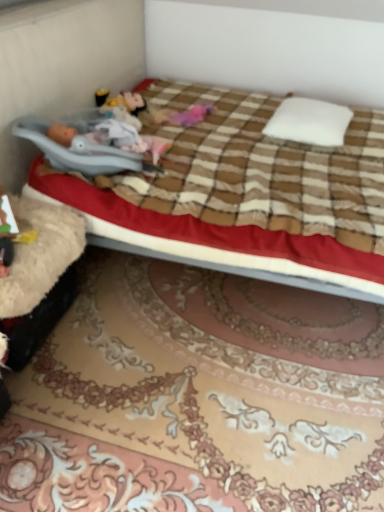
Question: From a real-world perspective, is pink fabric doll at center below white soft pillow at center?

Choices:
 (A) yes
 (B) no

Answer: (A)

Question: Is pink fabric doll at center placed right next to white soft pillow at center?

Choices:
 (A) no
 (B) yes

Answer: (A)

Question: Is white soft pillow at center inside pink fabric doll at center?

Choices:
 (A) yes
 (B) no

Answer: (B)

Question: Is pink fabric doll at center facing towards white soft pillow at center?

Choices:
 (A) no
 (B) yes

Answer: (A)

Question: Is pink fabric doll at center outside white soft pillow at center?

Choices:
 (A) no
 (B) yes

Answer: (B)

Question: From the image's perspective, is pink fabric doll at center on top of white soft pillow at center?

Choices:
 (A) yes
 (B) no

Answer: (A)

Question: From the image's perspective, would you say brown plaid blanket at center is shown under pink fabric doll at center?

Choices:
 (A) yes
 (B) no

Answer: (A)

Question: Is brown plaid blanket at center positioned before pink fabric doll at center?

Choices:
 (A) no
 (B) yes

Answer: (B)

Question: Is brown plaid blanket at center wider than pink fabric doll at center?

Choices:
 (A) yes
 (B) no

Answer: (A)

Question: Is brown plaid blanket at center further to the viewer compared to pink fabric doll at center?

Choices:
 (A) no
 (B) yes

Answer: (A)

Question: From the image's perspective, is brown plaid blanket at center above pink fabric doll at center?

Choices:
 (A) yes
 (B) no

Answer: (B)

Question: Considering the relative sizes of brown plaid blanket at center and pink fabric doll at center in the image provided, is brown plaid blanket at center bigger than pink fabric doll at center?

Choices:
 (A) yes
 (B) no

Answer: (A)

Question: Is brown plaid blanket at center at the back of pink fabric doll at center?

Choices:
 (A) no
 (B) yes

Answer: (B)